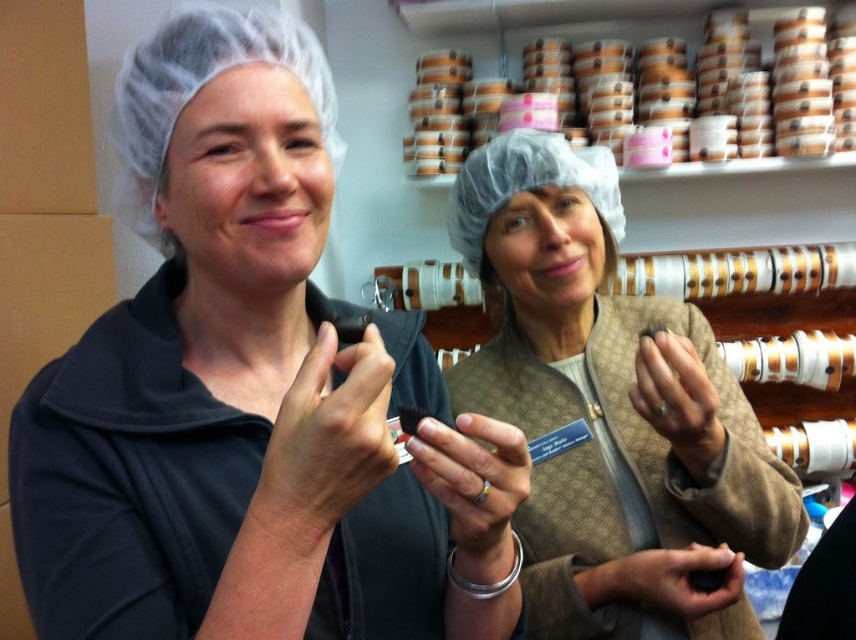
Question: Is matte black chocolate at center bigger than matte brown jacket at center?

Choices:
 (A) yes
 (B) no

Answer: (B)

Question: Which point appears farthest from the camera in this image?

Choices:
 (A) (672, 372)
 (B) (141, 620)

Answer: (A)

Question: Does matte black chocolate at center have a greater width compared to matte brown jacket at center?

Choices:
 (A) yes
 (B) no

Answer: (B)

Question: Among these points, which one is nearest to the camera?

Choices:
 (A) (12, 444)
 (B) (520, 426)

Answer: (A)

Question: Is matte black chocolate at center further to the viewer compared to matte brown jacket at center?

Choices:
 (A) yes
 (B) no

Answer: (B)